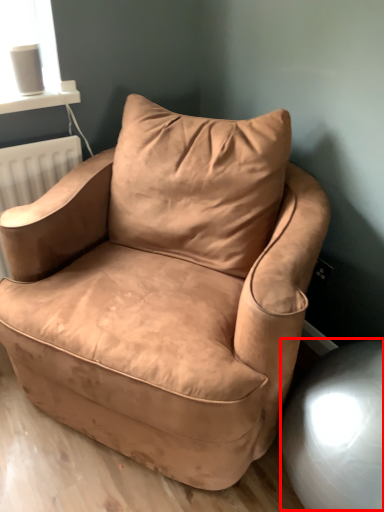
Question: Where is swivel chair (annotated by the red box) located in relation to chair in the image?

Choices:
 (A) left
 (B) right

Answer: (B)